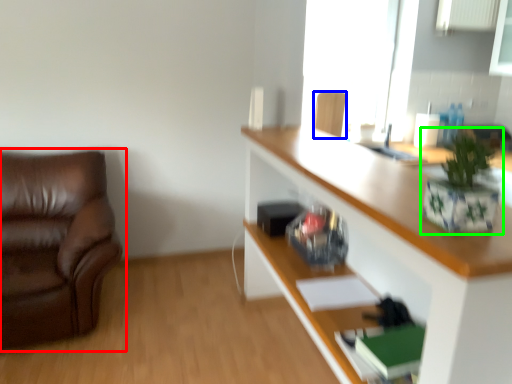
Question: Based on their relative distances, which object is farther from chair (highlighted by a red box)? Choose from chair (highlighted by a blue box) and houseplant (highlighted by a green box).

Choices:
 (A) chair
 (B) houseplant

Answer: (B)